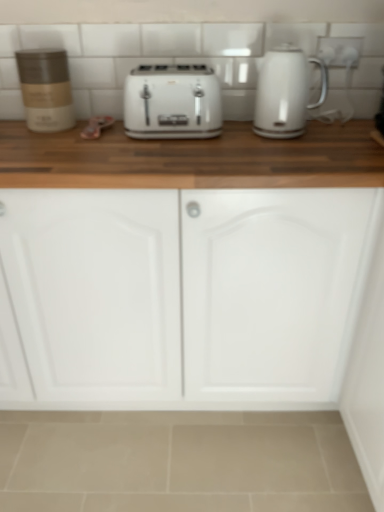
Question: Based on their positions, is white glossy toaster at center located to the left or right of white glossy electric kettle at upper right?

Choices:
 (A) right
 (B) left

Answer: (B)

Question: Considering the positions of point (190, 69) and point (261, 101), is point (190, 69) closer or farther from the camera than point (261, 101)?

Choices:
 (A) closer
 (B) farther

Answer: (B)

Question: Which of these objects is positioned closest to the white glossy electric outlet at upper right?

Choices:
 (A) white glossy electric kettle at upper right
 (B) matte brown container at left
 (C) white glossy toaster at center
 (D) white matte cabinet doors at center

Answer: (A)

Question: Which is nearer to the matte brown container at left?

Choices:
 (A) white glossy electric kettle at upper right
 (B) white glossy electric outlet at upper right
 (C) white glossy toaster at center
 (D) white matte cabinet doors at center

Answer: (C)